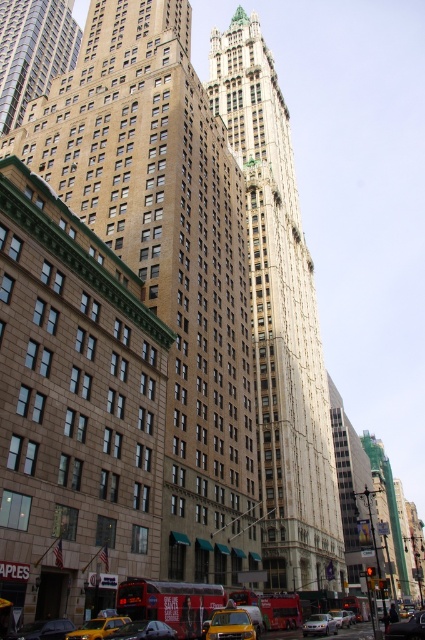
You are a pedestrian standing on the sidewalk looking at the brown stone building at upper left and the yellow matte taxi at lower center. Which object is positioned higher in the image?

The brown stone building at upper left is positioned higher in the image than the yellow matte taxi at lower center.

You are a city planner assessing the urban landscape. You need to determine which object, the brown stone building at center or the silver metallic sedan at center, occupies more vertical space in the scene. Based on the provided information, which one is taller?

The brown stone building at center is taller than the silver metallic sedan at center, so it occupies more vertical space in the scene.

You are a drone operator who needs to fly a drone between the brown stone building at upper left and the yellow matte taxi at lower center. The drone has a maximum flight distance of 450 feet. Can the drone safely make the trip without exceeding its range?

The brown stone building at upper left and the yellow matte taxi at lower center are 449.65 feet apart. Since the drone has a maximum flight distance of 450 feet, it can safely make the trip without exceeding its range.